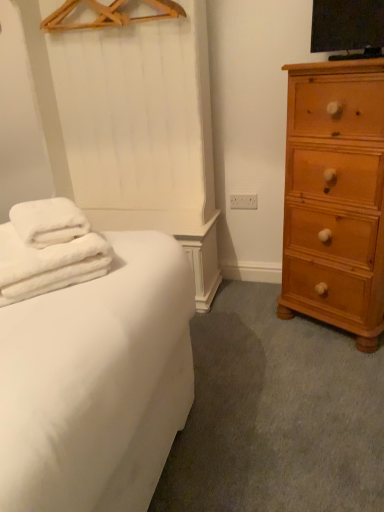
Identify the location of light brown wooden chest of drawers at right. (335, 197).

You are a GUI agent. You are given a task and a screenshot of the screen. Output one action in this format:
    pyautogui.click(x=<x>, y=<y>)
    Task: Click on the white fluffy towels at left
    The height and width of the screenshot is (512, 384).
    Given the screenshot: What is the action you would take?
    pyautogui.click(x=47, y=248)

Where is `light brown wooden chest of drawers at right`? Image resolution: width=384 pixels, height=512 pixels. light brown wooden chest of drawers at right is located at coordinates (335, 197).

From the image's perspective, is light brown wooden chest of drawers at right on wooden hanger at upper center?

Incorrect, from the image's perspective, light brown wooden chest of drawers at right is lower than wooden hanger at upper center.

Considering the points (373, 286) and (147, 2), which point is in front, point (373, 286) or point (147, 2)?

The point (373, 286) is closer to the camera.

What's the angular difference between light brown wooden chest of drawers at right and wooden hanger at upper center's facing directions?

They differ by 28.5 degrees in their facing directions.

From the picture: Considering the relative positions of light brown wooden chest of drawers at right and wooden hanger at upper center in the image provided, is light brown wooden chest of drawers at right to the left or to the right of wooden hanger at upper center?

Based on their positions, light brown wooden chest of drawers at right is located to the right of wooden hanger at upper center.

Considering the relative sizes of wooden hanger at upper center and light brown wooden chest of drawers at right in the image provided, is wooden hanger at upper center wider than light brown wooden chest of drawers at right?

No, wooden hanger at upper center is not wider than light brown wooden chest of drawers at right.

Does point (110, 16) come behind point (381, 170)?

Yes, point (110, 16) is behind point (381, 170).

Who is more distant, wooden hanger at upper center or light brown wooden chest of drawers at right?

Positioned behind is wooden hanger at upper center.

Looking at this image, from the image's perspective, which one is positioned higher, white fluffy towels at left or light brown wooden chest of drawers at right?

From the image's view, light brown wooden chest of drawers at right is above.

From a real-world perspective, is white fluffy towels at left beneath light brown wooden chest of drawers at right?

Incorrect, from a real-world perspective, white fluffy towels at left is higher than light brown wooden chest of drawers at right.

The height and width of the screenshot is (512, 384). Find the location of `chest of drawers behind the white fluffy towels at left`. chest of drawers behind the white fluffy towels at left is located at coordinates (x=335, y=197).

Measure the distance between wooden hanger at upper center and white fluffy towels at left.

4.28 feet.

From the image's perspective, is wooden hanger at upper center over white fluffy towels at left?

Yes, from the image's perspective, wooden hanger at upper center is over white fluffy towels at left.

From a real-world perspective, between wooden hanger at upper center and white fluffy towels at left, who is vertically higher?

From a 3D spatial view, wooden hanger at upper center is above.

Considering the sizes of objects wooden hanger at upper center and white fluffy towels at left in the image provided, who is smaller, wooden hanger at upper center or white fluffy towels at left?

wooden hanger at upper center.

Is light brown wooden chest of drawers at right with white fluffy towels at left?

No, light brown wooden chest of drawers at right is not in contact with white fluffy towels at left.

Based on the photo, is light brown wooden chest of drawers at right facing towards white fluffy towels at left?

Yes, light brown wooden chest of drawers at right is facing white fluffy towels at left.

What are the coordinates of `the chest of drawers that appears above the white fluffy towels at left (from the image's perspective)` in the screenshot? It's located at (335, 197).

From a real-world perspective, is light brown wooden chest of drawers at right physically below white fluffy towels at left?

Indeed, from a real-world perspective, light brown wooden chest of drawers at right is positioned beneath white fluffy towels at left.

Consider the image. Is white fluffy towels at left taller or shorter than wooden hanger at upper center?

Clearly, white fluffy towels at left is taller compared to wooden hanger at upper center.

This screenshot has height=512, width=384. Find the location of `bath towel below the wooden hanger at upper center (from the image's perspective)`. bath towel below the wooden hanger at upper center (from the image's perspective) is located at coordinates (47, 248).

From a real-world perspective, relative to wooden hanger at upper center, is white fluffy towels at left vertically above or below?

Clearly, from a real-world perspective, white fluffy towels at left is below wooden hanger at upper center.

Would you say white fluffy towels at left is outside wooden hanger at upper center?

Yes.

Locate an element on the screen. The width and height of the screenshot is (384, 512). hanger above the light brown wooden chest of drawers at right (from the image's perspective) is located at coordinates (107, 15).

The height and width of the screenshot is (512, 384). I want to click on chest of drawers on the right of wooden hanger at upper center, so click(x=335, y=197).

Which object lies further to the anchor point white fluffy towels at left, wooden hanger at upper center or light brown wooden chest of drawers at right?

wooden hanger at upper center is further to white fluffy towels at left.

When comparing their distances from wooden hanger at upper center, does light brown wooden chest of drawers at right or white fluffy towels at left seem closer?

Based on the image, light brown wooden chest of drawers at right appears to be nearer to wooden hanger at upper center.

Considering their positions, is light brown wooden chest of drawers at right positioned further to white fluffy towels at left than wooden hanger at upper center?

Among the two, wooden hanger at upper center is located further to white fluffy towels at left.

Considering their positions, is wooden hanger at upper center positioned closer to light brown wooden chest of drawers at right than white fluffy towels at left?

white fluffy towels at left lies closer to light brown wooden chest of drawers at right than the other object.

Considering their positions, is white fluffy towels at left positioned further to wooden hanger at upper center than light brown wooden chest of drawers at right?

white fluffy towels at left is further to wooden hanger at upper center.

Considering their positions, is white fluffy towels at left positioned closer to light brown wooden chest of drawers at right than wooden hanger at upper center?

white fluffy towels at left.

This screenshot has height=512, width=384. Find the location of `hanger between white fluffy towels at left and light brown wooden chest of drawers at right from left to right`. hanger between white fluffy towels at left and light brown wooden chest of drawers at right from left to right is located at coordinates (107, 15).